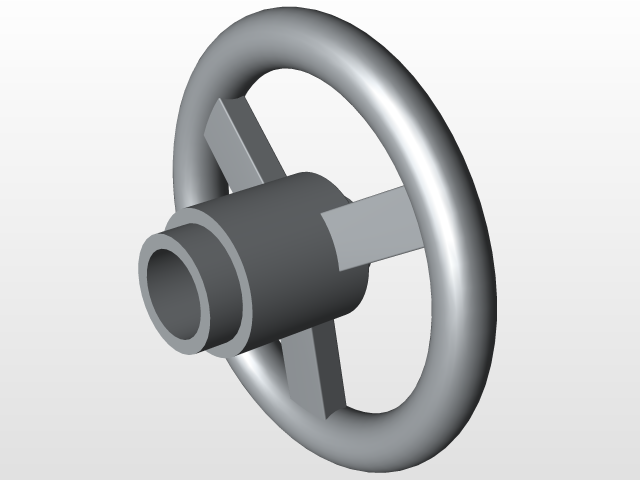
You are a GUI agent. You are given a task and a screenshot of the screen. Output one action in this format:
    pyautogui.click(x=<x>, y=<y>)
    Task: Click on the back of column
    
    Given the screenshot: What is the action you would take?
    pyautogui.click(x=177, y=287)